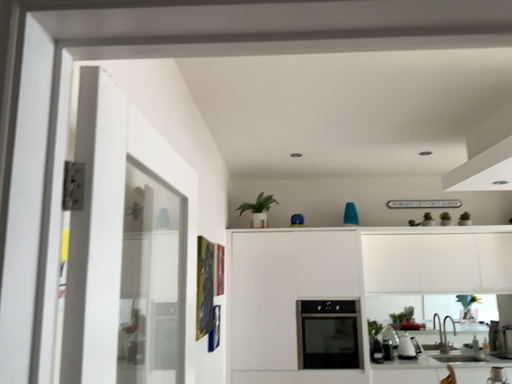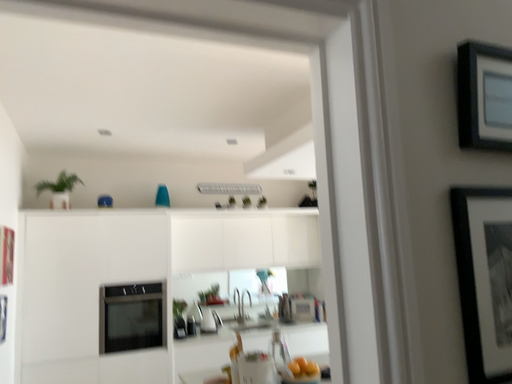
Question: How did the camera likely rotate when shooting the video?

Choices:
 (A) rotated right
 (B) rotated left

Answer: (A)